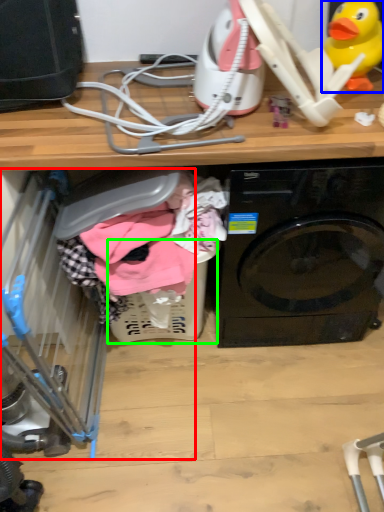
Question: Based on their relative distances, which object is nearer to baby carriage (highlighted by a red box)? Choose from toy (highlighted by a blue box) and basket (highlighted by a green box).

Choices:
 (A) toy
 (B) basket

Answer: (B)